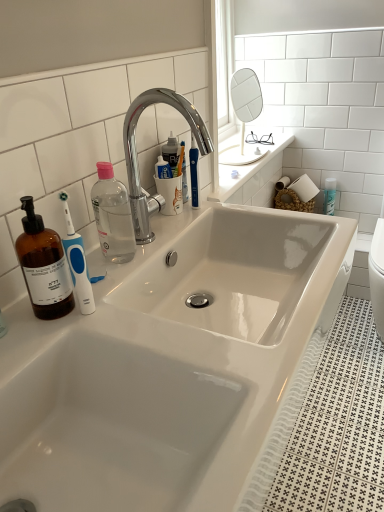
The height and width of the screenshot is (512, 384). I want to click on free area below chrome/metallic faucet at upper center (from a real-world perspective), so click(x=171, y=228).